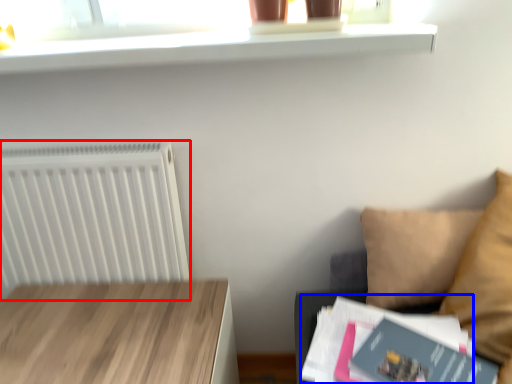
Question: Which of the following is the farthest to the observer, radiator (highlighted by a red box) or paperback book (highlighted by a blue box)?

Choices:
 (A) radiator
 (B) paperback book

Answer: (A)